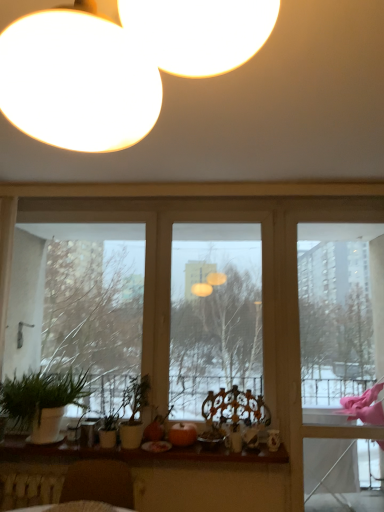
Question: From the image's perspective, is wooden at lower center below green matte plant at center, which ranks as the first houseplant in right-to-left order?

Choices:
 (A) yes
 (B) no

Answer: (A)

Question: Is wooden at lower center taller than green matte plant at center, which is counted as the second houseplant, starting from the left?

Choices:
 (A) yes
 (B) no

Answer: (B)

Question: Is wooden at lower center touching green matte plant at center, which is counted as the second houseplant, starting from the left?

Choices:
 (A) yes
 (B) no

Answer: (B)

Question: From a real-world perspective, is wooden at lower center positioned under green matte plant at center, which ranks as the first houseplant in right-to-left order, based on gravity?

Choices:
 (A) yes
 (B) no

Answer: (A)

Question: Is wooden at lower center smaller than green matte plant at center, which is counted as the second houseplant, starting from the left?

Choices:
 (A) no
 (B) yes

Answer: (B)

Question: Considering the relative positions of wooden at lower center and green matte plant at center, which is counted as the second houseplant, starting from the left, in the image provided, is wooden at lower center in front of green matte plant at center, which is counted as the second houseplant, starting from the left,?

Choices:
 (A) yes
 (B) no

Answer: (A)

Question: From a real-world perspective, does wooden at lower center stand above wooden round table at lower left?

Choices:
 (A) no
 (B) yes

Answer: (B)

Question: Is wooden at lower center positioned with its back to wooden round table at lower left?

Choices:
 (A) yes
 (B) no

Answer: (B)

Question: Is wooden at lower center positioned before wooden round table at lower left?

Choices:
 (A) no
 (B) yes

Answer: (A)

Question: Are wooden at lower center and wooden round table at lower left located far from each other?

Choices:
 (A) yes
 (B) no

Answer: (B)

Question: Does wooden at lower center have a larger size compared to wooden round table at lower left?

Choices:
 (A) yes
 (B) no

Answer: (A)

Question: Is wooden at lower center at the right side of wooden round table at lower left?

Choices:
 (A) no
 (B) yes

Answer: (B)

Question: Is green matte plant at lower left taller than green matte plant at center, which ranks as the first houseplant in right-to-left order?

Choices:
 (A) no
 (B) yes

Answer: (B)